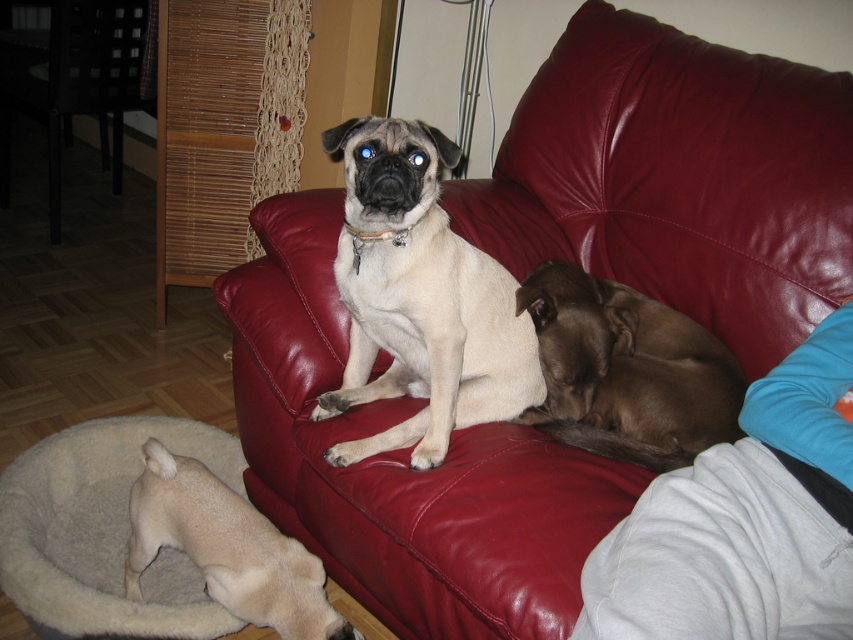
Based on the photo, you are standing in the living room and want to pick up two items located at point (x=849, y=253) and point (x=175, y=595). Which point is closer to you?

Point (x=849, y=253) is closer to the viewer than point (x=175, y=595), so you should pick up the item at point (x=849, y=253) first as it is nearer.

You are a pet sitter who needs to move the white fur dog at center to a different room. Can you lift it off the beige plush dog bed at lower left without disturbing it?

The white fur dog at center is positioned over the beige plush dog bed at lower left, so you can carefully lift it off the bed without disturbing it.

You are an interior designer planning to place a new lamp in the living room. The lamp must be positioned such that it is equidistant from the white fur dog at center and the pug on the red leather couch. Given the coordinates provided in the scene description, can you determine the coordinates where the lamp should be placed?

The coordinates for the lamp placement would be the midpoint between the white fur dog at center and the pug on the red leather couch. Since the white fur dog at center is at point [421,298], the lamp should be placed at the midpoint coordinates between these two points.